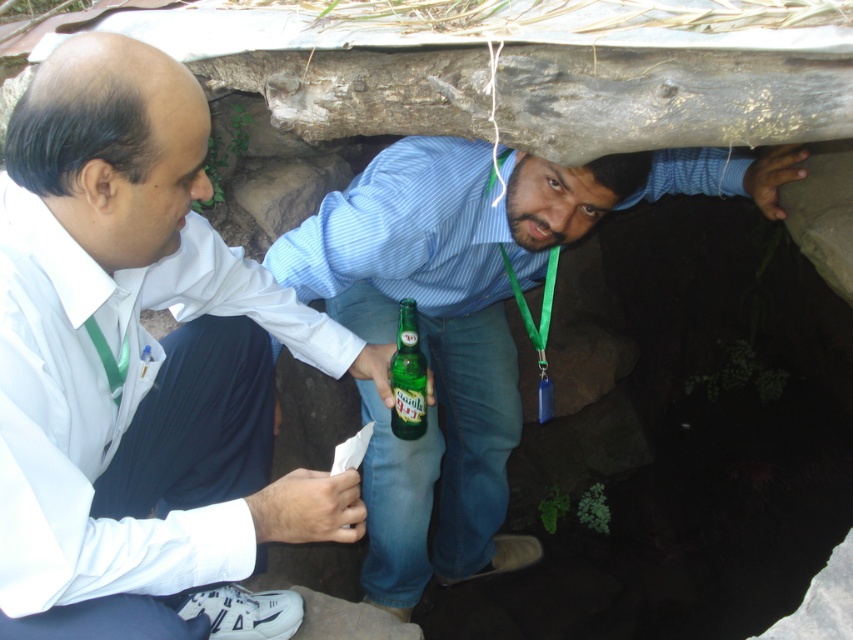
Between white shirt at center and matte green glass bottle at center, which one appears on the right side from the viewer's perspective?

From the viewer's perspective, matte green glass bottle at center appears more on the right side.

Who is taller, white shirt at center or matte green glass bottle at center?

matte green glass bottle at center is taller.

Identify the location of white shirt at center. (142, 369).

Find the location of a particular element. The width and height of the screenshot is (853, 640). white shirt at center is located at coordinates (142, 369).

Describe the element at coordinates (142, 369) in the screenshot. This screenshot has height=640, width=853. I see `white shirt at center` at that location.

From the picture: Between white shirt at center and green glass bottle at center, which one is positioned higher?

green glass bottle at center is higher up.

Does point (51, 564) come in front of point (419, 371)?

Yes, it is.

The width and height of the screenshot is (853, 640). Find the location of `white shirt at center`. white shirt at center is located at coordinates (142, 369).

Is matte green glass bottle at center bigger than green glass bottle at center?

Yes.

Between matte green glass bottle at center and green glass bottle at center, which one has less height?

Standing shorter between the two is green glass bottle at center.

Find the location of `matte green glass bottle at center`. matte green glass bottle at center is located at coordinates (467, 317).